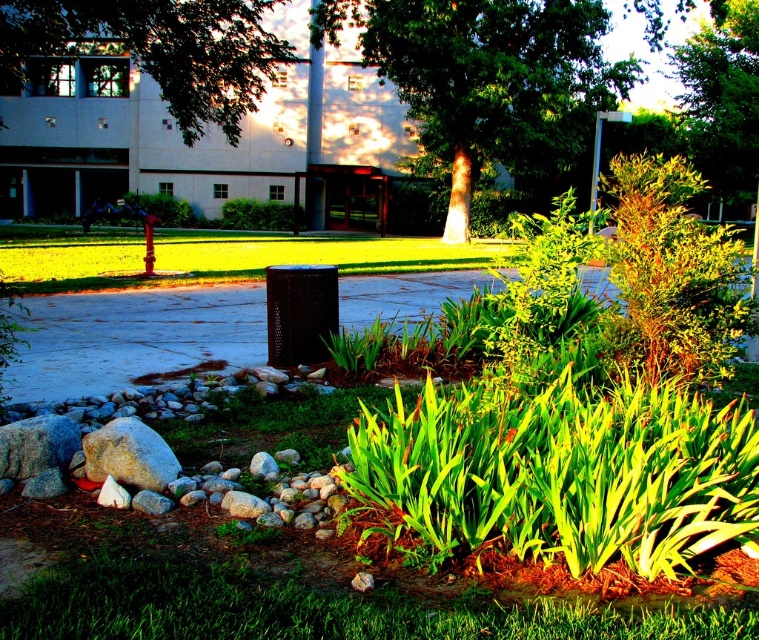
You are standing in the landscaped area looking towards the pathway. There are two points marked in the scene, one at point coordinates point (128, 600) and another at point coordinates point (745, 42). Which point is closer to you?

Point (128, 600) is closer to the viewer than point (745, 42).

You are standing in the landscaped area and want to take a photo of the green leafy tree at center and the green leafy tree at upper center. Which tree is positioned lower in the image?

The green leafy tree at center is located below the green leafy tree at upper center, so the green leafy tree at center is positioned lower in the image.

You are standing at the point labeled point (156, 49) in the image. Looking towards the green leafy tree at upper left, which direction should you walk to reach the dark metal trash can in the middle ground?

The point (156, 49) is the green leafy tree at upper left. To reach the dark metal trash can in the middle ground, you should walk south towards the center of the image.